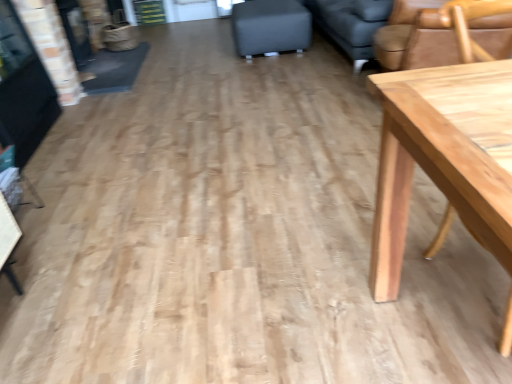
What do you see at coordinates (416, 38) in the screenshot? This screenshot has width=512, height=384. I see `light brown wood chair at upper right` at bounding box center [416, 38].

Find the location of a particular element. light brown wood chair at upper right is located at coordinates (416, 38).

This screenshot has width=512, height=384. What do you see at coordinates (270, 27) in the screenshot?
I see `matte black ottoman at center` at bounding box center [270, 27].

The height and width of the screenshot is (384, 512). Identify the location of matte black ottoman at center. (270, 27).

Image resolution: width=512 pixels, height=384 pixels. I want to click on light brown wood chair at upper right, so click(x=416, y=38).

Between matte black ottoman at center and light brown wood chair at upper right, which one appears on the right side from the viewer's perspective?

From the viewer's perspective, light brown wood chair at upper right appears more on the right side.

In the image, is matte black ottoman at center positioned in front of or behind light brown wood chair at upper right?

Clearly, matte black ottoman at center is behind light brown wood chair at upper right.

Is point (249, 14) closer or farther from the camera than point (472, 27)?

Point (249, 14).

From the image's perspective, is matte black ottoman at center on top of light brown wood chair at upper right?

Indeed, from the image's perspective, matte black ottoman at center is shown above light brown wood chair at upper right.

From a real-world perspective, is matte black ottoman at center physically above light brown wood chair at upper right?

No, from a real-world perspective, matte black ottoman at center is not on top of light brown wood chair at upper right.

Between matte black ottoman at center and light brown wood chair at upper right, which one has smaller width?

With smaller width is matte black ottoman at center.

Is matte black ottoman at center shorter than light brown wood chair at upper right?

Yes.

From the picture: Is matte black ottoman at center bigger than light brown wood chair at upper right?

No.

Choose the correct answer: Is matte black ottoman at center inside light brown wood chair at upper right or outside it?

matte black ottoman at center is not inside light brown wood chair at upper right, it's outside.

Are matte black ottoman at center and light brown wood chair at upper right making contact?

There is a gap between matte black ottoman at center and light brown wood chair at upper right.

Is matte black ottoman at center oriented towards light brown wood chair at upper right?

No, matte black ottoman at center is not oriented towards light brown wood chair at upper right.

Locate an element on the screen. This screenshot has width=512, height=384. swivel chair above the light brown wood chair at upper right (from the image's perspective) is located at coordinates (270, 27).

Is light brown wood chair at upper right at the left side of matte black ottoman at center?

No.

Which object is more forward, light brown wood chair at upper right or matte black ottoman at center?

light brown wood chair at upper right.

Does point (417, 34) come behind point (241, 6)?

No, it is not.

From the image's perspective, is light brown wood chair at upper right beneath matte black ottoman at center?

Yes, from the image's perspective, light brown wood chair at upper right is beneath matte black ottoman at center.

From a real-world perspective, which object stands above the other?

In real-world perspective, light brown wood chair at upper right is above.

Which of these two, light brown wood chair at upper right or matte black ottoman at center, is thinner?

Result: matte black ottoman at center is thinner.

Considering the relative sizes of light brown wood chair at upper right and matte black ottoman at center in the image provided, is light brown wood chair at upper right taller than matte black ottoman at center?

Yes.

Can you confirm if light brown wood chair at upper right is bigger than matte black ottoman at center?

Yes.

Do you think light brown wood chair at upper right is within matte black ottoman at center, or outside of it?

light brown wood chair at upper right cannot be found inside matte black ottoman at center.

Are light brown wood chair at upper right and matte black ottoman at center located far from each other?

light brown wood chair at upper right is positioned a significant distance from matte black ottoman at center.

Based on the photo, is matte black ottoman at center at the back of light brown wood chair at upper right?

No, light brown wood chair at upper right is not facing the opposite direction of matte black ottoman at center.

How many degrees apart are the facing directions of light brown wood chair at upper right and matte black ottoman at center?

light brown wood chair at upper right and matte black ottoman at center are facing 14.6 degrees away from each other.

How distant is light brown wood chair at upper right from matte black ottoman at center?

They are 4.62 feet apart.

Identify the location of swivel chair behind the light brown wood chair at upper right. (270, 27).

Image resolution: width=512 pixels, height=384 pixels. I want to click on swivel chair lying above the light brown wood chair at upper right (from the image's perspective), so click(x=270, y=27).

At what (x,y) coordinates should I click in order to perform the action: click on chair above the matte black ottoman at center (from a real-world perspective). Please return your answer as a coordinate pair (x, y). Image resolution: width=512 pixels, height=384 pixels. Looking at the image, I should click on (416, 38).